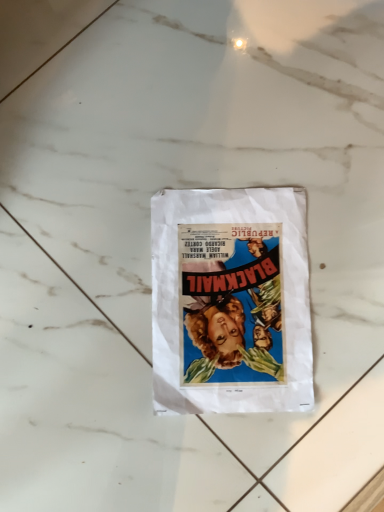
What do you see at coordinates (231, 301) in the screenshot? I see `vintage paper poster at center` at bounding box center [231, 301].

Where is `vintage paper poster at center`? This screenshot has width=384, height=512. vintage paper poster at center is located at coordinates (231, 301).

Identify the location of vintage paper poster at center. (231, 301).